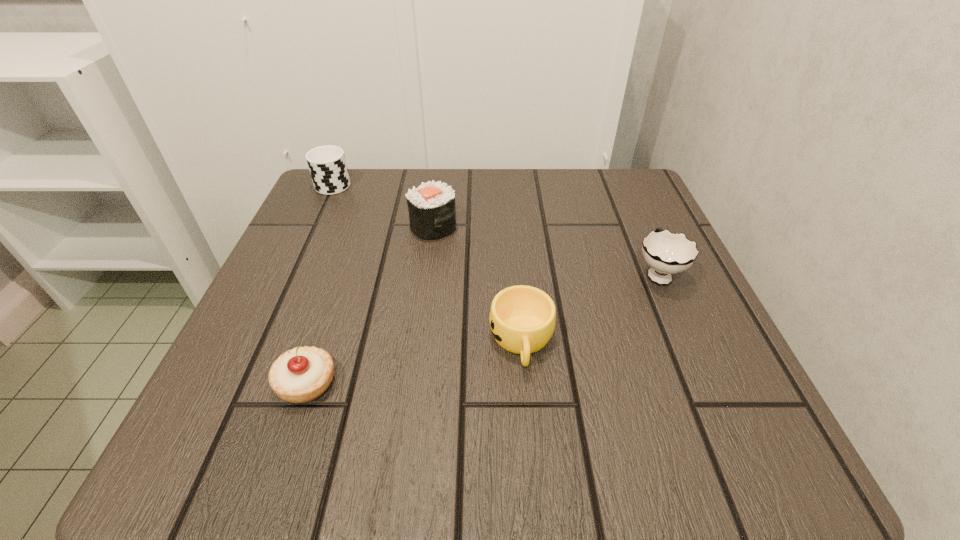
Image resolution: width=960 pixels, height=540 pixels. Find the location of `the fourth nearest object`. the fourth nearest object is located at coordinates (432, 214).

The image size is (960, 540). Find the location of `the third object from right to left`. the third object from right to left is located at coordinates click(432, 214).

At what (x,y) coordinates should I click in order to perform the action: click on the leftmost cup. Please return your answer as a coordinate pair (x, y). Image resolution: width=960 pixels, height=540 pixels. Looking at the image, I should click on (327, 165).

Find the location of a particular element. The height and width of the screenshot is (540, 960). the farthest object is located at coordinates (327, 165).

You are a GUI agent. You are given a task and a screenshot of the screen. Output one action in this format:
    pyautogui.click(x=<x>, y=<y>)
    Task: Click on the rightmost object
    The image size is (960, 540).
    Given the screenshot: What is the action you would take?
    pyautogui.click(x=667, y=253)

Identify the location of the third farthest object. The image size is (960, 540). (667, 253).

Where is `the second object from left to right`? the second object from left to right is located at coordinates (302, 374).

Identify the location of the second cup from left to right. (522, 318).

Locate an element on the screen. the nearest cup is located at coordinates (522, 318).

I want to click on vacant space situated 0.190m on the right of the second farthest object, so click(551, 226).